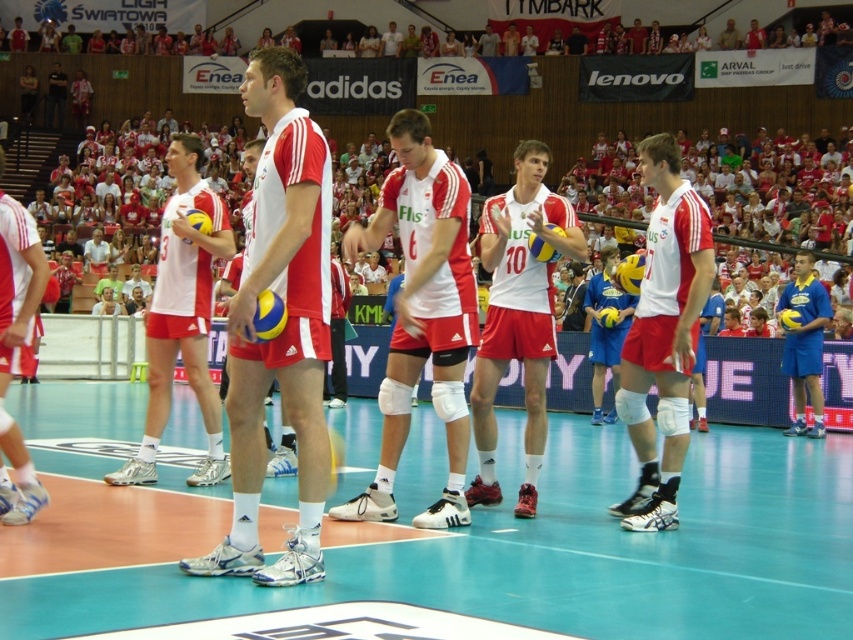
Question: Which object appears farthest from the camera in this image?

Choices:
 (A) matte red shorts at center
 (B) white matte knee pads at center
 (C) white matte volleyball at center

Answer: (C)

Question: Which point is farther from the camera taking this photo?

Choices:
 (A) (190, 209)
 (B) (473, 400)
 (C) (813, 372)

Answer: (C)

Question: Does white matte volleyball at center have a greater width compared to blue jersey at center?

Choices:
 (A) no
 (B) yes

Answer: (B)

Question: Can you confirm if matte red shorts at center is positioned above white matte volleyball at center?

Choices:
 (A) no
 (B) yes

Answer: (B)

Question: Can you confirm if matte white jersey at center is positioned to the left of blue jersey at center?

Choices:
 (A) yes
 (B) no

Answer: (A)

Question: Which point is closer to the camera?

Choices:
 (A) (196, 298)
 (B) (640, 456)
 (C) (813, 360)
 (D) (535, 412)

Answer: (B)